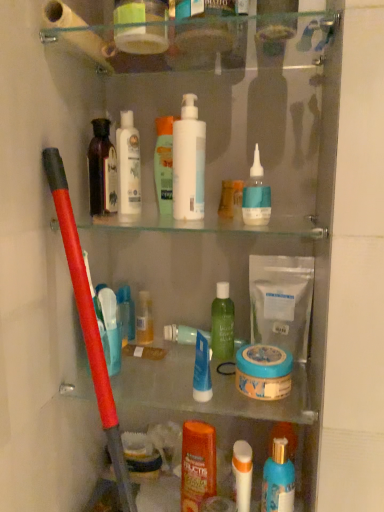
Question: Is green matte bottle at center, which is counted as the fourth toiletry, starting from the top, facing away from white matte bag at center, the first cleaning product in the right-to-left sequence?

Choices:
 (A) no
 (B) yes

Answer: (A)

Question: Would you say white matte bag at center, the first cleaning product in the right-to-left sequence, is part of green matte bottle at center, which ranks as the fifth toiletry in bottom-to-top order,'s contents?

Choices:
 (A) yes
 (B) no

Answer: (B)

Question: Can you see green matte bottle at center, which is counted as the fourth toiletry, starting from the top, touching white matte bag at center, which is the 4th cleaning product in left-to-right order?

Choices:
 (A) no
 (B) yes

Answer: (A)

Question: Can you confirm if green matte bottle at center, which is counted as the fourth toiletry, starting from the top, is bigger than white matte bag at center, which is the 4th cleaning product in left-to-right order?

Choices:
 (A) no
 (B) yes

Answer: (A)

Question: Is green matte bottle at center, which ranks as the fifth toiletry in bottom-to-top order, further to the viewer compared to white matte bag at center, the first cleaning product in the right-to-left sequence?

Choices:
 (A) yes
 (B) no

Answer: (A)

Question: In terms of height, does translucent plastic pump bottle at center, which is counted as the 2th toiletry, starting from the top, look taller or shorter compared to blue matte jar at center, the second mouthwash from the bottom?

Choices:
 (A) short
 (B) tall

Answer: (B)

Question: Is translucent plastic pump bottle at center, arranged as the seventh toiletry when ordered from the bottom, inside or outside of blue matte jar at center, the second mouthwash from the bottom?

Choices:
 (A) outside
 (B) inside

Answer: (A)

Question: From a real-world perspective, is translucent plastic pump bottle at center, which is counted as the 2th toiletry, starting from the top, above or below blue matte jar at center, the second mouthwash from the bottom?

Choices:
 (A) above
 (B) below

Answer: (A)

Question: Based on their sizes in the image, would you say translucent plastic pump bottle at center, which is counted as the 2th toiletry, starting from the top, is bigger or smaller than blue matte jar at center, positioned as the 1th mouthwash in top-to-bottom order?

Choices:
 (A) small
 (B) big

Answer: (A)

Question: Considering their positions, is white matte lotion at center, which ranks as the first cleaning product in left-to-right order, located in front of or behind translucent plastic pump bottle at center, arranged as the seventh toiletry when ordered from the bottom?

Choices:
 (A) behind
 (B) front

Answer: (A)

Question: Is white matte lotion at center, which ranks as the first cleaning product in left-to-right order, wider or thinner than translucent plastic pump bottle at center, which is counted as the 2th toiletry, starting from the top?

Choices:
 (A) thin
 (B) wide

Answer: (B)

Question: From a real-world perspective, is white matte lotion at center, the fourth cleaning product positioned from the right, physically located above or below translucent plastic pump bottle at center, arranged as the seventh toiletry when ordered from the bottom?

Choices:
 (A) above
 (B) below

Answer: (A)

Question: From the image's perspective, relative to translucent plastic pump bottle at center, which is counted as the 2th toiletry, starting from the top, is white matte lotion at center, which ranks as the first cleaning product in left-to-right order, above or below?

Choices:
 (A) below
 (B) above

Answer: (B)

Question: From their relative heights in the image, would you say blue matte bottle at upper right, the third cleaning product positioned from the left, is taller or shorter than white matte lotion at center, which ranks as the first cleaning product in left-to-right order?

Choices:
 (A) short
 (B) tall

Answer: (A)

Question: From a real-world perspective, is blue matte bottle at upper right, the 2th cleaning product when ordered from right to left, positioned above or below white matte lotion at center, the fourth cleaning product positioned from the right?

Choices:
 (A) below
 (B) above

Answer: (A)